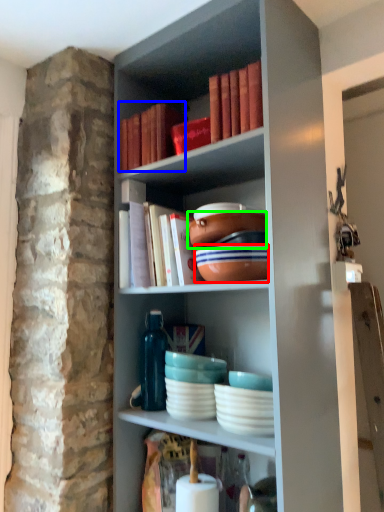
Question: Which object is the farthest from bowl (highlighted by a red box)? Choose among these: book (highlighted by a blue box) or bowl (highlighted by a green box).

Choices:
 (A) book
 (B) bowl

Answer: (A)